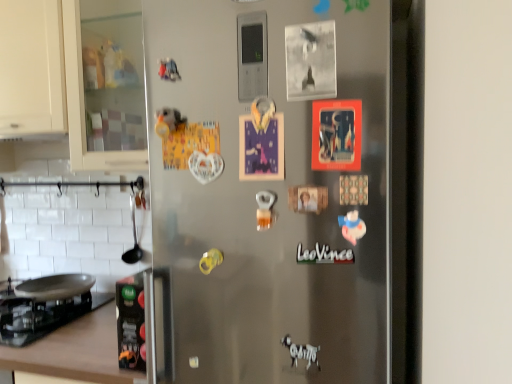
Question: From a real-world perspective, relative to satin silver fridge at center, is matte white text at center vertically above or below?

Choices:
 (A) below
 (B) above

Answer: (A)

Question: Is matte white text at center inside or outside of satin silver fridge at center?

Choices:
 (A) outside
 (B) inside

Answer: (B)

Question: Which object is positioned farthest from the matte white text at center?

Choices:
 (A) brown wood countertop at lower left
 (B) satin silver fridge at center
 (C) black glass gas stove at lower left

Answer: (C)

Question: Which of these objects is positioned farthest from the matte white text at center?

Choices:
 (A) black glass gas stove at lower left
 (B) satin silver fridge at center
 (C) brown wood countertop at lower left

Answer: (A)